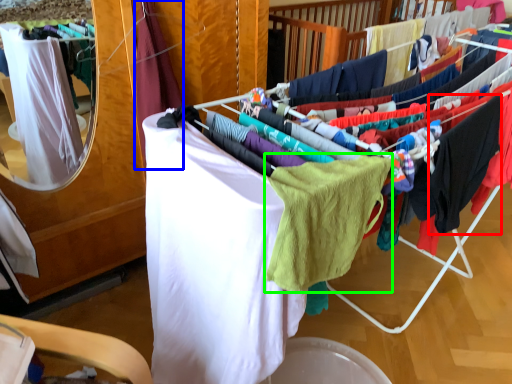
Question: Which object is positioned closest to clothing (highlighted by a red box)? Select from clothing (highlighted by a blue box) and baby clothe (highlighted by a green box).

Choices:
 (A) clothing
 (B) baby clothe

Answer: (B)